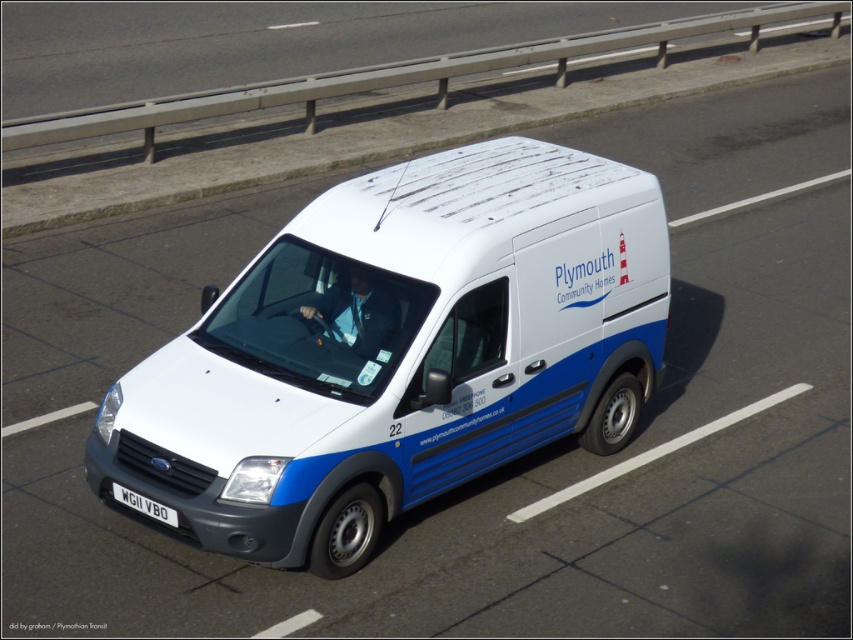
You are a pedestrian standing at the side of the road where the white and blue van is driving. You notice two points on the road ahead of you at coordinates point (x=531, y=292) and point (x=136, y=493). Which point is closer to your position?

Point (x=136, y=493) is closer to your position because it is less further to the camera than point (x=531, y=292).

You are a pedestrian standing on the sidewalk next to the white matte van at center. You want to cross the road to reach a bus stop located on the other side. The road is 7.82 meters wide. Is the road too wide for you to cross safely in one attempt?

The road is 7.82 meters wide. While this is wider than a typical residential road, it is still manageable for a pedestrian to cross safely in one attempt if they ensure there is enough time and space between vehicles. However, always check for oncoming traffic and use crosswalks if available.